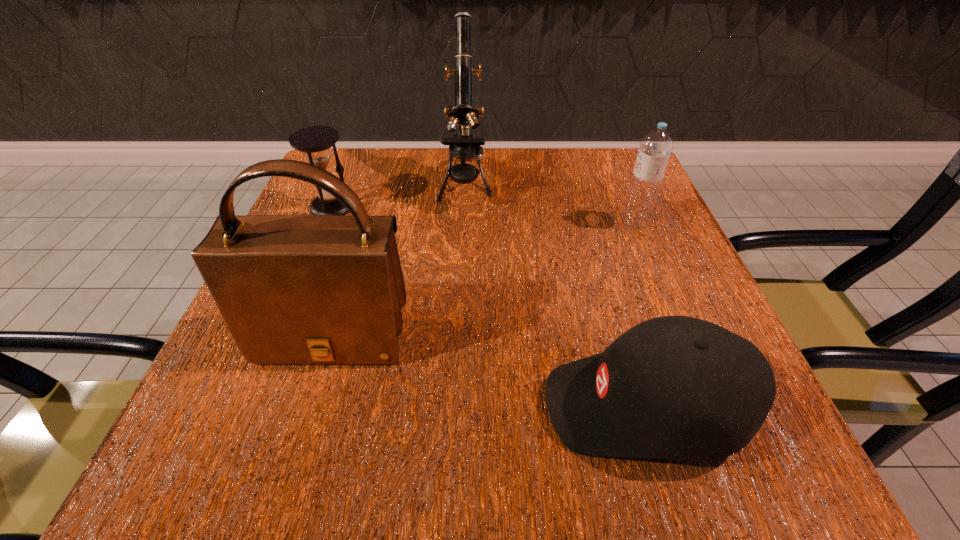
The image size is (960, 540). What are the coordinates of `vacant area between the hourglass and the third shortest object` in the screenshot? It's located at pyautogui.click(x=484, y=214).

The width and height of the screenshot is (960, 540). Identify the location of free space between the third object from left to right and the third shortest object. (550, 204).

I want to click on vacant point located between the shortest object and the hourglass, so click(x=489, y=306).

At what (x,y) coordinates should I click in order to perform the action: click on free space between the hourglass and the third object from left to right. Please return your answer as a coordinate pair (x, y). This screenshot has width=960, height=540. Looking at the image, I should click on (399, 196).

Locate an element on the screen. vacant area that lies between the shoulder bag and the third tallest object is located at coordinates (x=484, y=279).

This screenshot has height=540, width=960. Identify the location of free space between the third object from right to left and the water bottle. (550, 204).

Point out which object is positioned as the third nearest to the shortest object. Please provide its 2D coordinates. Your answer should be formatted as a tuple, i.e. [(x, y)], where the tuple contains the x and y coordinates of a point satisfying the conditions above.

[(464, 146)]

Identify the location of object identified as the third closest to the shortest object. (464, 146).

The image size is (960, 540). Find the location of `free spot that satisfies the following two spatial constraints: 1. on the front side of the water bottle; 2. with a logo on the front of the baseball cap`. free spot that satisfies the following two spatial constraints: 1. on the front side of the water bottle; 2. with a logo on the front of the baseball cap is located at coordinates (711, 406).